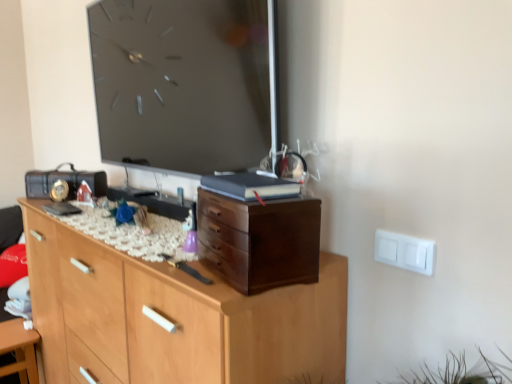
This screenshot has width=512, height=384. Describe the element at coordinates (175, 317) in the screenshot. I see `wooden chest of drawers at center, the first chest of drawers ordered from the bottom` at that location.

The width and height of the screenshot is (512, 384). Find the location of `wooden chest of drawers at center, arranged as the second chest of drawers when viewed from the top`. wooden chest of drawers at center, arranged as the second chest of drawers when viewed from the top is located at coordinates (175, 317).

Considering the relative positions of white glossy table at lower left and dark wood chest of drawers at center, placed as the 1th chest of drawers when sorted from top to bottom, in the image provided, is white glossy table at lower left to the left of dark wood chest of drawers at center, placed as the 1th chest of drawers when sorted from top to bottom, from the viewer's perspective?

Yes, white glossy table at lower left is to the left of dark wood chest of drawers at center, placed as the 1th chest of drawers when sorted from top to bottom.

How many degrees apart are the facing directions of white glossy table at lower left and dark wood chest of drawers at center, which appears as the second chest of drawers when ordered from the bottom?

The facing directions of white glossy table at lower left and dark wood chest of drawers at center, which appears as the second chest of drawers when ordered from the bottom, are 12.9 degrees apart.

From the image's perspective, which one is positioned higher, white glossy table at lower left or dark wood chest of drawers at center, placed as the 1th chest of drawers when sorted from top to bottom?

dark wood chest of drawers at center, placed as the 1th chest of drawers when sorted from top to bottom, is shown above in the image.

Is wooden chest of drawers at center, arranged as the second chest of drawers when viewed from the top, turned away from dark wood chest of drawers at center, which appears as the second chest of drawers when ordered from the bottom?

wooden chest of drawers at center, arranged as the second chest of drawers when viewed from the top, is not turned away from dark wood chest of drawers at center, which appears as the second chest of drawers when ordered from the bottom.

How different are the orientations of wooden chest of drawers at center, arranged as the second chest of drawers when viewed from the top, and dark wood chest of drawers at center, placed as the 1th chest of drawers when sorted from top to bottom, in degrees?

11.2 degrees.

Can you confirm if wooden chest of drawers at center, the first chest of drawers ordered from the bottom, is taller than dark wood chest of drawers at center, which appears as the second chest of drawers when ordered from the bottom?

Yes.

From the image's perspective, between wooden chest of drawers at center, the first chest of drawers ordered from the bottom, and dark wood chest of drawers at center, placed as the 1th chest of drawers when sorted from top to bottom, who is located below?

wooden chest of drawers at center, the first chest of drawers ordered from the bottom, appears lower in the image.

Looking at this image, considering their positions, is wooden chest of drawers at center, arranged as the second chest of drawers when viewed from the top, located in front of or behind white glossy table at lower left?

Clearly, wooden chest of drawers at center, arranged as the second chest of drawers when viewed from the top, is in front of white glossy table at lower left.

From the image's perspective, is wooden chest of drawers at center, the first chest of drawers ordered from the bottom, on top of white glossy table at lower left?

Indeed, from the image's perspective, wooden chest of drawers at center, the first chest of drawers ordered from the bottom, is shown above white glossy table at lower left.

Considering the positions of objects wooden chest of drawers at center, the first chest of drawers ordered from the bottom, and white glossy table at lower left in the image provided, who is more to the left, wooden chest of drawers at center, the first chest of drawers ordered from the bottom, or white glossy table at lower left?

Positioned to the left is white glossy table at lower left.

Looking at this image, is wooden chest of drawers at center, arranged as the second chest of drawers when viewed from the top, oriented towards white glossy table at lower left?

Yes, wooden chest of drawers at center, arranged as the second chest of drawers when viewed from the top, is turned towards white glossy table at lower left.

Considering the relative positions of dark wood chest of drawers at center, placed as the 1th chest of drawers when sorted from top to bottom, and white glossy table at lower left in the image provided, is dark wood chest of drawers at center, placed as the 1th chest of drawers when sorted from top to bottom, to the right of white glossy table at lower left from the viewer's perspective?

Yes, dark wood chest of drawers at center, placed as the 1th chest of drawers when sorted from top to bottom, is to the right of white glossy table at lower left.

From the image's perspective, which is above, dark wood chest of drawers at center, placed as the 1th chest of drawers when sorted from top to bottom, or white glossy table at lower left?

dark wood chest of drawers at center, placed as the 1th chest of drawers when sorted from top to bottom, from the image's perspective.

Is dark wood chest of drawers at center, which appears as the second chest of drawers when ordered from the bottom, turned away from white glossy table at lower left?

dark wood chest of drawers at center, which appears as the second chest of drawers when ordered from the bottom, does not have its back to white glossy table at lower left.

Do you think dark wood chest of drawers at center, placed as the 1th chest of drawers when sorted from top to bottom, is within white glossy table at lower left, or outside of it?

dark wood chest of drawers at center, placed as the 1th chest of drawers when sorted from top to bottom, is not inside white glossy table at lower left, it's outside.

Which is less distant, (272, 287) or (340, 348)?

Point (272, 287) is positioned closer to the camera compared to point (340, 348).

From the image's perspective, is dark wood chest of drawers at center, placed as the 1th chest of drawers when sorted from top to bottom, below wooden chest of drawers at center, the first chest of drawers ordered from the bottom?

No, from the image's perspective, dark wood chest of drawers at center, placed as the 1th chest of drawers when sorted from top to bottom, is not below wooden chest of drawers at center, the first chest of drawers ordered from the bottom.

Would you say dark wood chest of drawers at center, placed as the 1th chest of drawers when sorted from top to bottom, is to the left or to the right of wooden chest of drawers at center, arranged as the second chest of drawers when viewed from the top, in the picture?

Clearly, dark wood chest of drawers at center, placed as the 1th chest of drawers when sorted from top to bottom, is on the right of wooden chest of drawers at center, arranged as the second chest of drawers when viewed from the top, in the image.

Considering the relative positions of white glossy table at lower left and wooden chest of drawers at center, arranged as the second chest of drawers when viewed from the top, in the image provided, is white glossy table at lower left to the left or to the right of wooden chest of drawers at center, arranged as the second chest of drawers when viewed from the top,?

white glossy table at lower left is positioned on wooden chest of drawers at center, arranged as the second chest of drawers when viewed from the top,'s left side.

From a real-world perspective, who is located lower, white glossy table at lower left or wooden chest of drawers at center, the first chest of drawers ordered from the bottom?

In real-world perspective, white glossy table at lower left is lower.

Can you tell me how much white glossy table at lower left and wooden chest of drawers at center, the first chest of drawers ordered from the bottom, differ in facing direction?

There is a 1.71-degree angle between the facing directions of white glossy table at lower left and wooden chest of drawers at center, the first chest of drawers ordered from the bottom.

From the picture: Is white glossy table at lower left completely or partially outside of wooden chest of drawers at center, arranged as the second chest of drawers when viewed from the top?

Yes.

From a real-world perspective, count 2nd chest of drawerss upward from the white glossy table at lower left and point to it. Please provide its 2D coordinates.

[(260, 240)]

This screenshot has width=512, height=384. Find the location of `chest of drawers on the left of the dark wood chest of drawers at center, placed as the 1th chest of drawers when sorted from top to bottom`. chest of drawers on the left of the dark wood chest of drawers at center, placed as the 1th chest of drawers when sorted from top to bottom is located at coordinates (175, 317).

When comparing their distances from dark wood chest of drawers at center, which appears as the second chest of drawers when ordered from the bottom, does wooden chest of drawers at center, the first chest of drawers ordered from the bottom, or white glossy table at lower left seem closer?

wooden chest of drawers at center, the first chest of drawers ordered from the bottom, lies closer to dark wood chest of drawers at center, which appears as the second chest of drawers when ordered from the bottom, than the other object.

Estimate the real-world distances between objects in this image. Which object is further from wooden chest of drawers at center, the first chest of drawers ordered from the bottom, white glossy table at lower left or dark wood chest of drawers at center, which appears as the second chest of drawers when ordered from the bottom?

white glossy table at lower left.

Which object lies nearer to the anchor point wooden chest of drawers at center, the first chest of drawers ordered from the bottom, dark wood chest of drawers at center, which appears as the second chest of drawers when ordered from the bottom, or white glossy table at lower left?

The object closer to wooden chest of drawers at center, the first chest of drawers ordered from the bottom, is dark wood chest of drawers at center, which appears as the second chest of drawers when ordered from the bottom.

Based on their spatial positions, is wooden chest of drawers at center, the first chest of drawers ordered from the bottom, or dark wood chest of drawers at center, which appears as the second chest of drawers when ordered from the bottom, closer to white glossy table at lower left?

Based on the image, wooden chest of drawers at center, the first chest of drawers ordered from the bottom, appears to be nearer to white glossy table at lower left.

Based on their spatial positions, is dark wood chest of drawers at center, placed as the 1th chest of drawers when sorted from top to bottom, or wooden chest of drawers at center, the first chest of drawers ordered from the bottom, further from white glossy table at lower left?

dark wood chest of drawers at center, placed as the 1th chest of drawers when sorted from top to bottom, is further to white glossy table at lower left.

Based on their spatial positions, is white glossy table at lower left or wooden chest of drawers at center, the first chest of drawers ordered from the bottom, closer to dark wood chest of drawers at center, which appears as the second chest of drawers when ordered from the bottom?

wooden chest of drawers at center, the first chest of drawers ordered from the bottom, is positioned closer to the anchor dark wood chest of drawers at center, which appears as the second chest of drawers when ordered from the bottom.

Find the location of a particular element. The image size is (512, 384). chest of drawers between dark wood chest of drawers at center, which appears as the second chest of drawers when ordered from the bottom, and white glossy table at lower left from front to back is located at coordinates (175, 317).